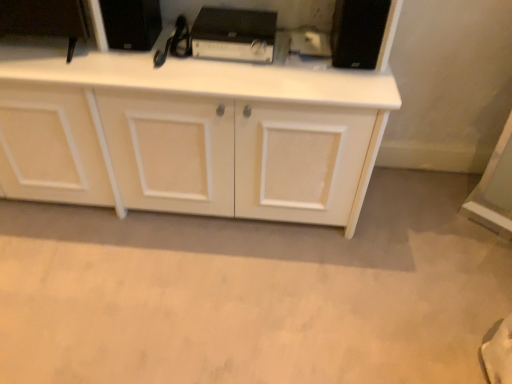
Image resolution: width=512 pixels, height=384 pixels. What are the coordinates of `free space above black plastic amplifier at center, arranged as the second appliance when viewed from the right (from a real-world perspective)` in the screenshot? It's located at [230, 14].